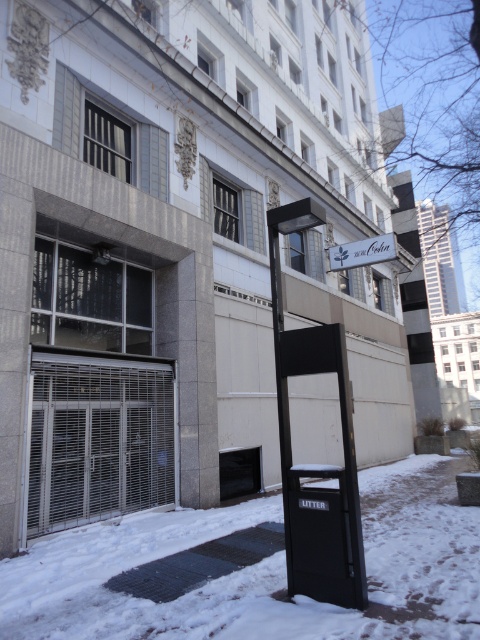
Question: Which of the following is the closest to the observer?

Choices:
 (A) white powdery snow at lower left
 (B) white matte sign at upper center

Answer: (A)

Question: In this image, where is white powdery snow at lower left located relative to white matte sign at upper center?

Choices:
 (A) left
 (B) right

Answer: (A)

Question: Does white powdery snow at lower left have a lesser width compared to white matte sign at upper center?

Choices:
 (A) yes
 (B) no

Answer: (B)

Question: Does white powdery snow at lower left appear on the right side of white matte sign at upper center?

Choices:
 (A) yes
 (B) no

Answer: (B)